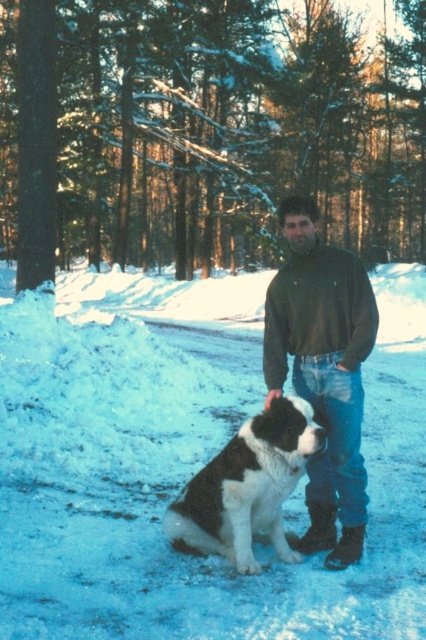
You are a hiker who has just arrived at the snowy forest area. You notice the white fluffy snow at center and the black and white fur at center. Which object is higher in this scene?

The white fluffy snow at center is much taller than the black and white fur at center, so the white fluffy snow at center is higher in this scene.

Based on the photo, you are planning to take a photo of the dark green sweater at center and the black and white fur at center in the winter forest scene. Which object is wider in the image?

The black and white fur at center is wider than the dark green sweater at center in the image.